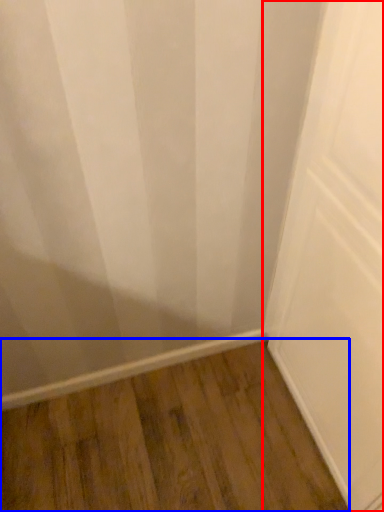
Question: Which object appears farthest to the camera in this image, door (highlighted by a red box) or hardwood (highlighted by a blue box)?

Choices:
 (A) door
 (B) hardwood

Answer: (B)